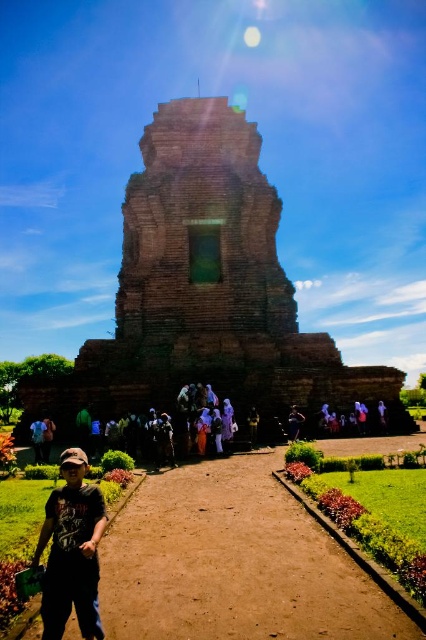
You are a photographer positioned at the entrance of the historical brick structure. You want to capture a photo that includes both the dark blue fabric at center and the brown fabric tourist at center. Which object should you adjust your camera angle to focus on first to ensure both are in the frame?

The dark blue fabric at center is closer to you than the brown fabric tourist at center. To ensure both are in focus, adjust your camera angle to focus on the dark blue fabric at center first, then compose the shot so the brown fabric tourist at center is also visible in the background.

You are a photographer planning to capture a group photo of the dark gray fabric cap at lower left and the blue denim jeans at lower left. Based on their positions, which object should you focus on first to ensure both are in frame?

The dark gray fabric cap at lower left is much taller than the blue denim jeans at lower left, so you should focus on the dark gray fabric cap at lower left first to ensure both are in frame.